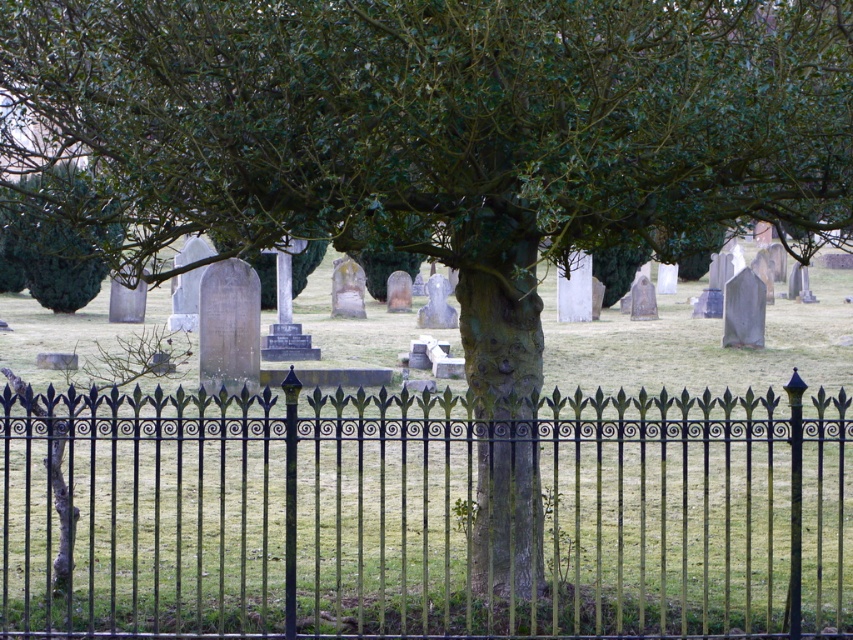
Which is above, black wrought iron fence at center or green leafy tree at upper left?

green leafy tree at upper left is above.

Consider the image. Between black wrought iron fence at center and green leafy tree at upper left, which one appears on the left side from the viewer's perspective?

From the viewer's perspective, green leafy tree at upper left appears more on the left side.

Between point (283, 540) and point (20, 184), which one is positioned behind?

Positioned behind is point (20, 184).

Find the location of a particular element. Image resolution: width=853 pixels, height=640 pixels. black wrought iron fence at center is located at coordinates (422, 515).